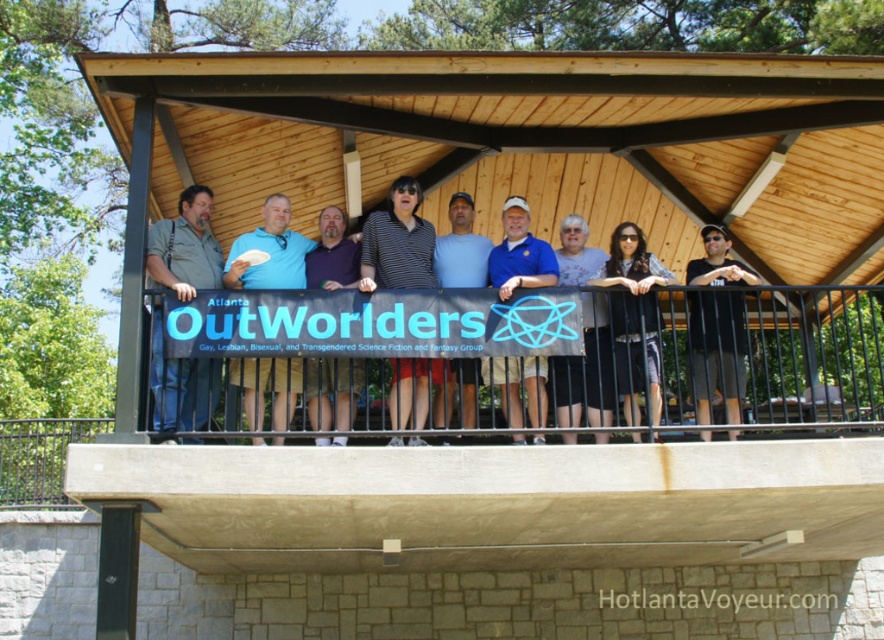
Between black matte shirt at center and black textured shirt at center, which one appears on the right side from the viewer's perspective?

black matte shirt at center

Between black matte shirt at center and black textured shirt at center, which one appears on the left side from the viewer's perspective?

black textured shirt at center is more to the left.

What do you see at coordinates (717, 349) in the screenshot?
I see `black matte shirt at center` at bounding box center [717, 349].

I want to click on black matte shirt at center, so pyautogui.click(x=717, y=349).

Can you confirm if striped polo shirt at center is shorter than black matte shirt at center?

Correct, striped polo shirt at center is not as tall as black matte shirt at center.

Is striped polo shirt at center taller than black matte shirt at center?

No.

The width and height of the screenshot is (884, 640). What do you see at coordinates (397, 243) in the screenshot? I see `striped polo shirt at center` at bounding box center [397, 243].

Locate an element on the screen. This screenshot has width=884, height=640. striped polo shirt at center is located at coordinates (397, 243).

Between point (493, 282) and point (334, 380), which one is positioned in front?

Point (334, 380) is in front.

Is blue cotton polo shirt at center below purple shirt at center?

No.

Find the location of a particular element. This screenshot has width=884, height=640. blue cotton polo shirt at center is located at coordinates (519, 253).